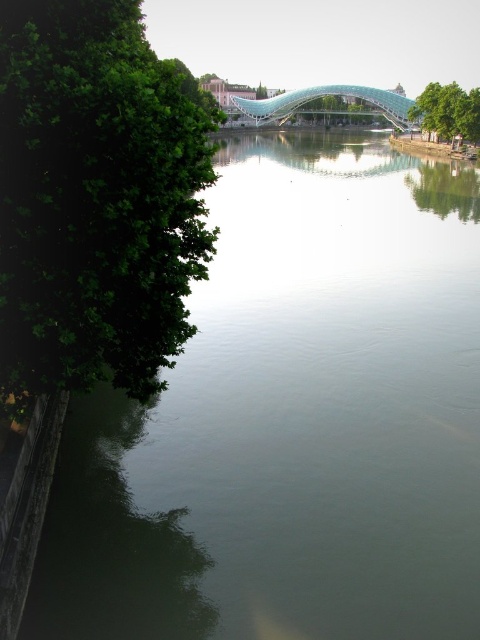
Can you confirm if green leafy tree at upper right is positioned to the right of green leafy tree at center?

Indeed, green leafy tree at upper right is positioned on the right side of green leafy tree at center.

You are a GUI agent. You are given a task and a screenshot of the screen. Output one action in this format:
    pyautogui.click(x=<x>, y=<y>)
    Task: Click on the green leafy tree at upper right
    
    Given the screenshot: What is the action you would take?
    pyautogui.click(x=447, y=112)

Can you confirm if green leafy tree at left is thinner than green leafy tree at center?

Incorrect, green leafy tree at left's width is not less than green leafy tree at center's.

Is green leafy tree at left behind green leafy tree at center?

No.

This screenshot has width=480, height=640. In order to click on green leafy tree at left in this screenshot , I will do `click(96, 196)`.

Is green leafy tree at left wider than green leafy tree at upper right?

Indeed, green leafy tree at left has a greater width compared to green leafy tree at upper right.

Image resolution: width=480 pixels, height=640 pixels. Find the location of `green leafy tree at left`. green leafy tree at left is located at coordinates (96, 196).

Measure the distance between point (154, 316) and camera.

They are 25.02 meters apart.

This screenshot has width=480, height=640. Find the location of `green leafy tree at left`. green leafy tree at left is located at coordinates (96, 196).